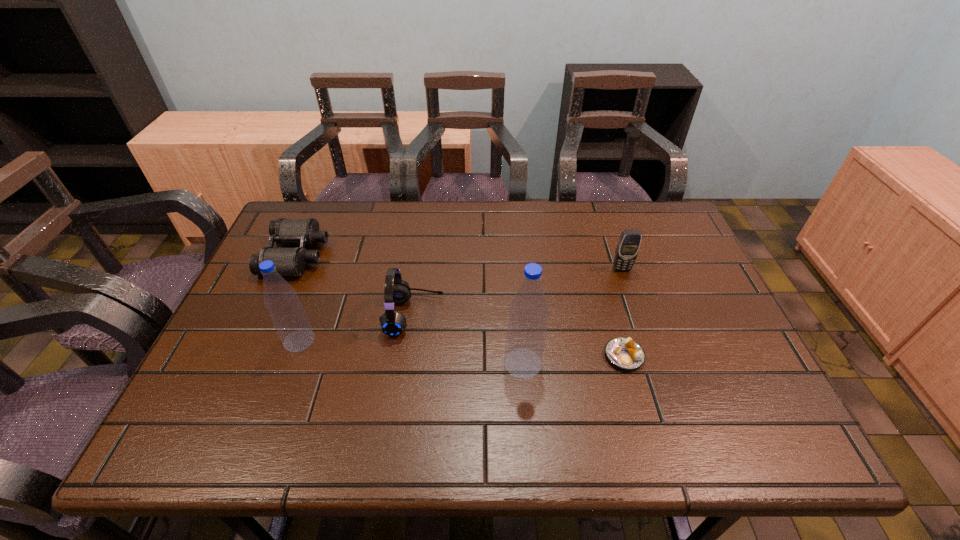
Find the location of a particular element. The width and height of the screenshot is (960, 540). vacant space that satisfies the following two spatial constraints: 1. through the eyepieces of the binoculars; 2. on the right side of the fifth shortest object is located at coordinates click(x=258, y=341).

At what (x,y) coordinates should I click in order to perform the action: click on free space that satisfies the following two spatial constraints: 1. through the eyepieces of the pastry; 2. on the right side of the binoculars. Please return your answer as a coordinate pair (x, y). Looking at the image, I should click on (251, 356).

Where is `free space that satisfies the following two spatial constraints: 1. on the back side of the right water bottle; 2. on the ear cushions of the headset`? Image resolution: width=960 pixels, height=540 pixels. free space that satisfies the following two spatial constraints: 1. on the back side of the right water bottle; 2. on the ear cushions of the headset is located at coordinates (519, 315).